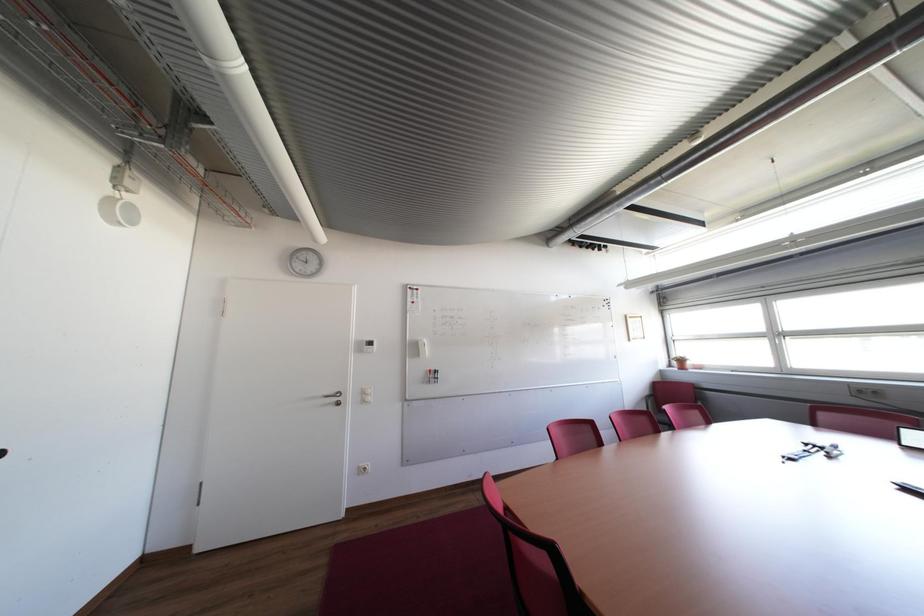
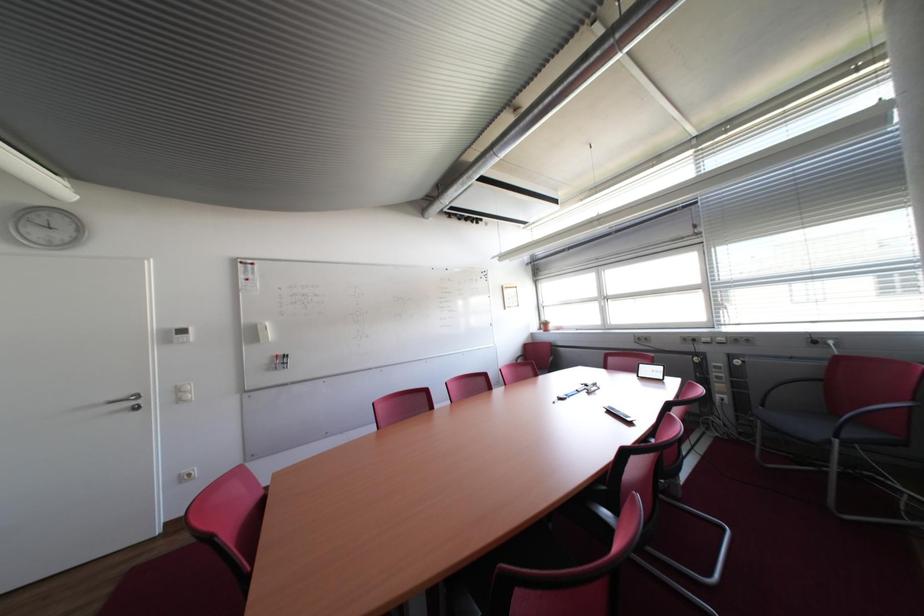
Question: The camera is either moving clockwise (left) or counter-clockwise (right) around the object. The first image is from the beginning of the video and the second image is from the end. Is the camera moving left or right when shooting the video?

Choices:
 (A) Left
 (B) Right

Answer: (A)